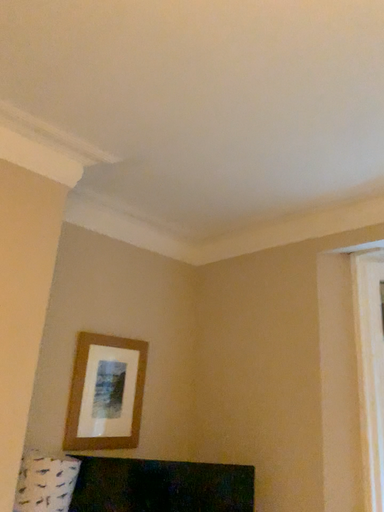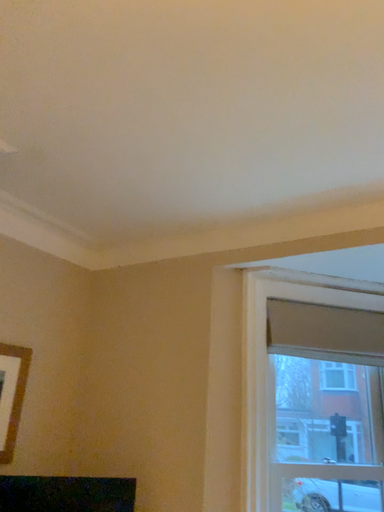
Question: How did the camera likely rotate when shooting the video?

Choices:
 (A) rotated right
 (B) rotated left

Answer: (A)